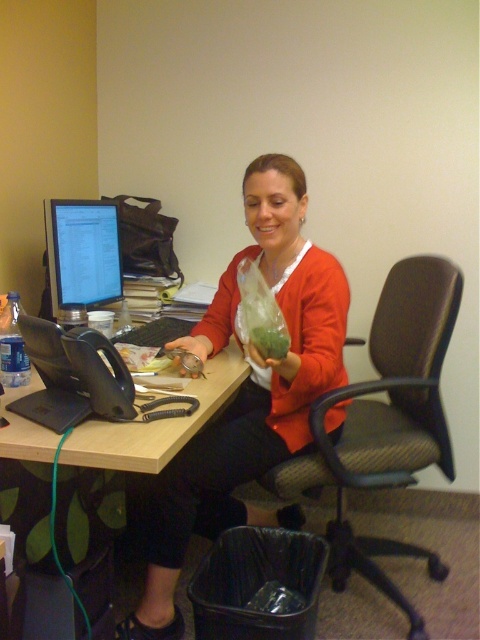
Does matte red sweater at center appear over brown fabric swivel chair at center?

No, matte red sweater at center is not above brown fabric swivel chair at center.

Can you confirm if matte red sweater at center is positioned below brown fabric swivel chair at center?

Indeed, matte red sweater at center is positioned under brown fabric swivel chair at center.

Does point (228, 448) lie behind point (411, 474)?

No, it is in front of (411, 474).

I want to click on matte red sweater at center, so click(x=243, y=396).

Between matte red sweater at center and matte black monitor at left, which one has less height?

matte black monitor at left is shorter.

Between matte red sweater at center and matte black monitor at left, which one appears on the right side from the viewer's perspective?

matte red sweater at center is more to the right.

Is point (299, 193) in front of point (118, 250)?

Yes, it is in front of point (118, 250).

The width and height of the screenshot is (480, 640). Find the location of `matte red sweater at center`. matte red sweater at center is located at coordinates (243, 396).

Can you confirm if wooden desk at center is positioned to the right of matte black monitor at left?

Correct, you'll find wooden desk at center to the right of matte black monitor at left.

Which is behind, point (66, 529) or point (47, 243)?

The point (47, 243) is more distant.

What do you see at coordinates (112, 474) in the screenshot? I see `wooden desk at center` at bounding box center [112, 474].

Where is `wooden desk at center`? wooden desk at center is located at coordinates (112, 474).